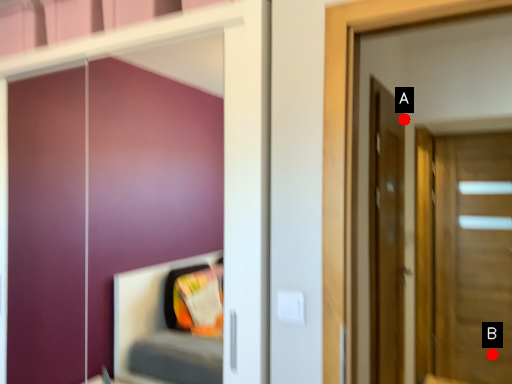
Question: Two points are circled on the image, labeled by A and B beside each circle. Among these points, which one is nearest to the camera?

Choices:
 (A) A is closer
 (B) B is closer

Answer: (A)